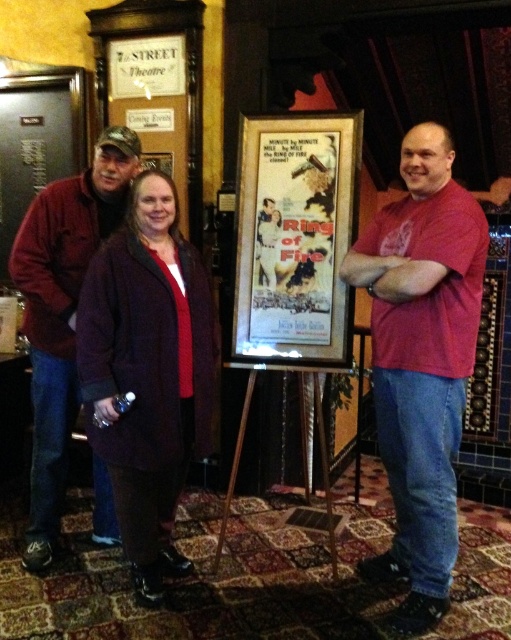
You are a photographer trying to adjust the lighting for a group photo in the theater lobby. You notice the red matte shirt at center is at point (422, 362). Where should you position the key light to ensure it illuminates the red matte shirt at center properly?

The key light should be positioned to the left of the red matte shirt at center, as the point (422, 362) indicates its location, allowing the light to effectively illuminate it without harsh shadows.

You are a photographer adjusting the camera settings for a group photo. The subjects are wearing a red matte shirt at center and a maroon fleece jacket at center. Which clothing item should you focus on first if you want to ensure both are in sharp focus, considering their sizes?

The red matte shirt at center is larger in size compared to the maroon fleece jacket at center, so focusing on the larger red matte shirt at center first will help ensure both are in sharp focus.